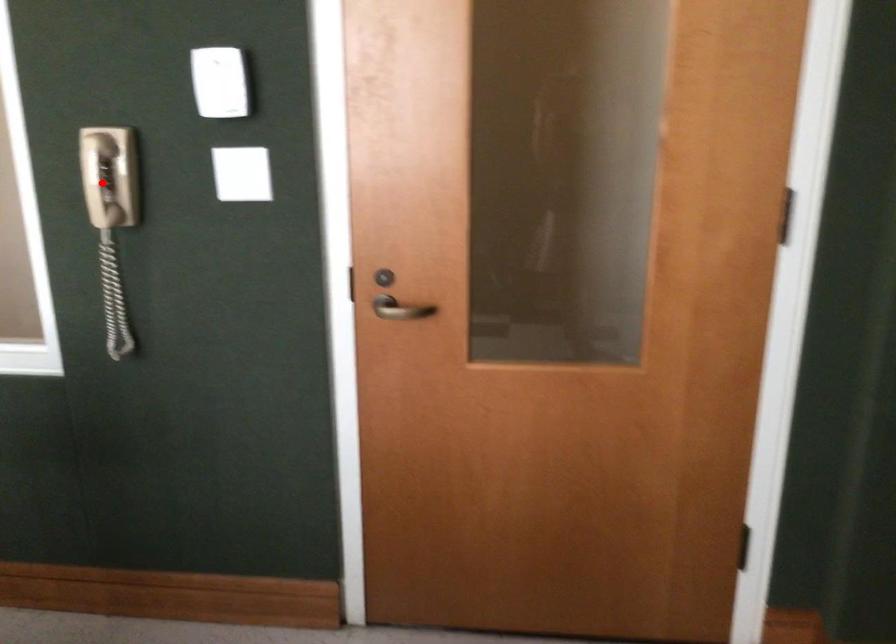
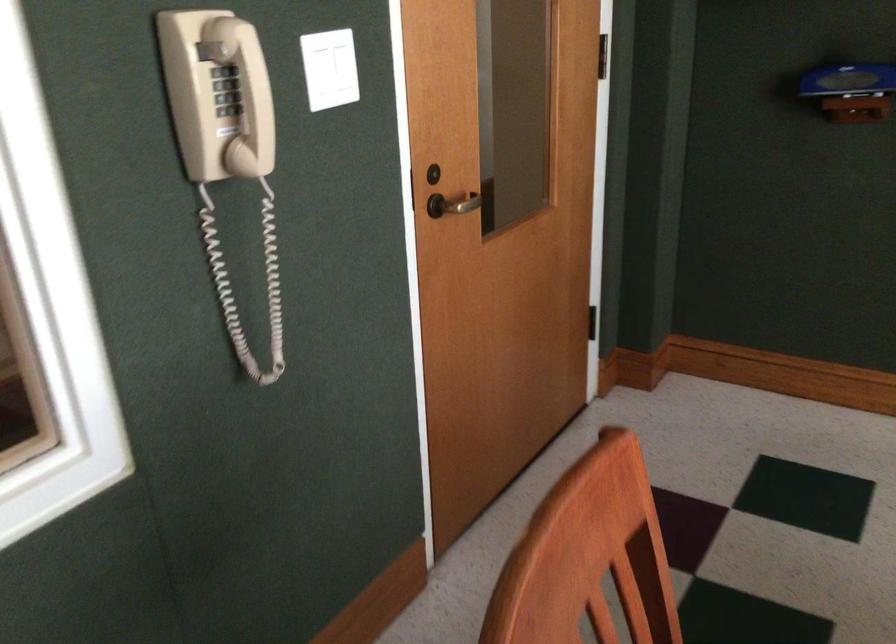
Where in the second image is the point corresponding to the highlighted location from the first image?

(226, 90)